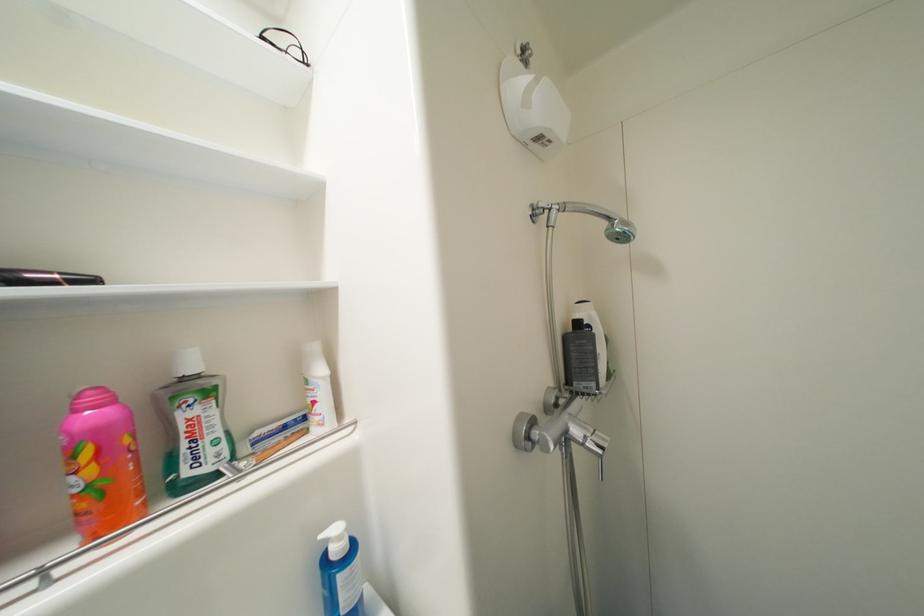
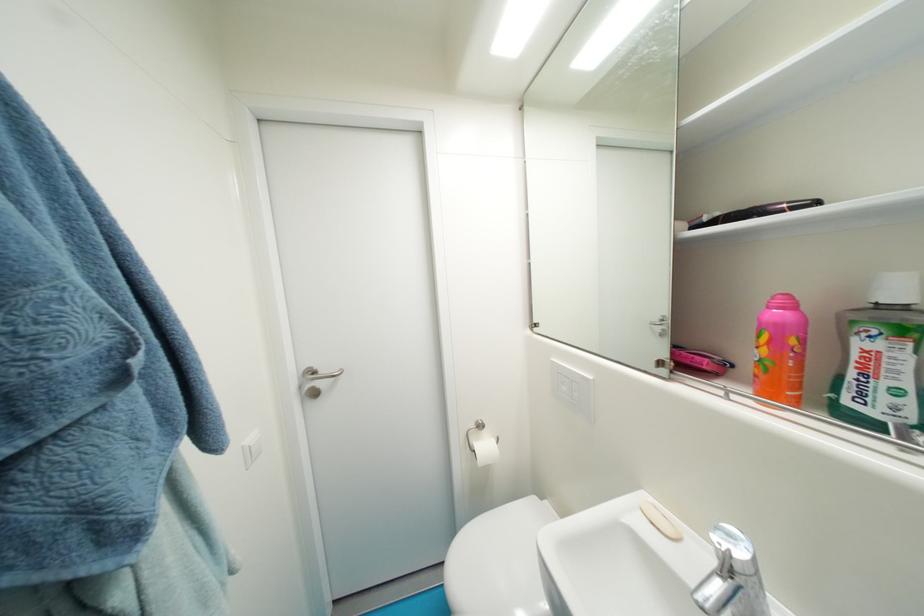
Question: I am providing you with two images of the same scene from different viewpoints. Please identify which objects are invisible in image2.

Choices:
 (A) bar of soap
 (B) pink and orange bottle
 (C) white light switch
 (D) none of these

Answer: (D)